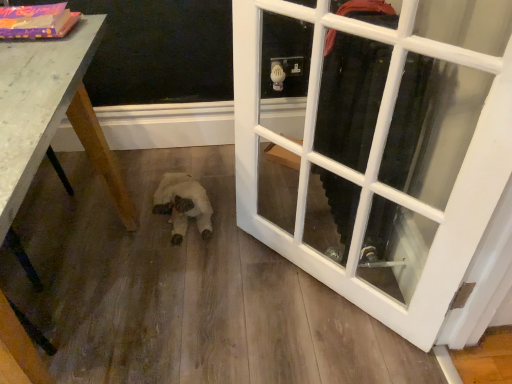
Question: From a real-world perspective, is white plush toy at center physically located above or below white glass door at center?

Choices:
 (A) below
 (B) above

Answer: (A)

Question: Is white plush toy at center bigger or smaller than white glass door at center?

Choices:
 (A) big
 (B) small

Answer: (B)

Question: Which object is the closest to the wooden table at lower left?

Choices:
 (A) white glass door at center
 (B) white plush toy at center

Answer: (B)

Question: Based on their relative distances, which object is nearer to the white glass door at center?

Choices:
 (A) white plush toy at center
 (B) wooden table at lower left

Answer: (A)